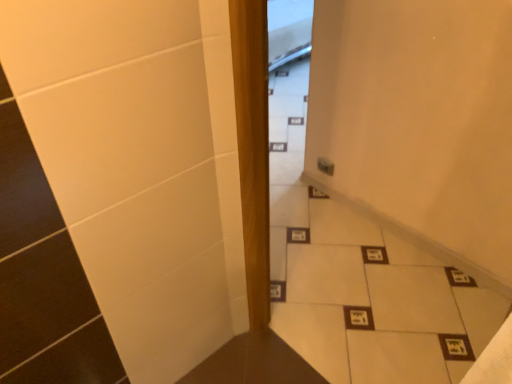
What do you see at coordinates (370, 298) in the screenshot? I see `white tile stairwell at center` at bounding box center [370, 298].

The height and width of the screenshot is (384, 512). Find the location of `white tile stairwell at center`. white tile stairwell at center is located at coordinates (370, 298).

At what (x,y) coordinates should I click in order to perform the action: click on white tile stairwell at center. Please return your answer as a coordinate pair (x, y). This screenshot has width=512, height=384. Looking at the image, I should click on coord(370,298).